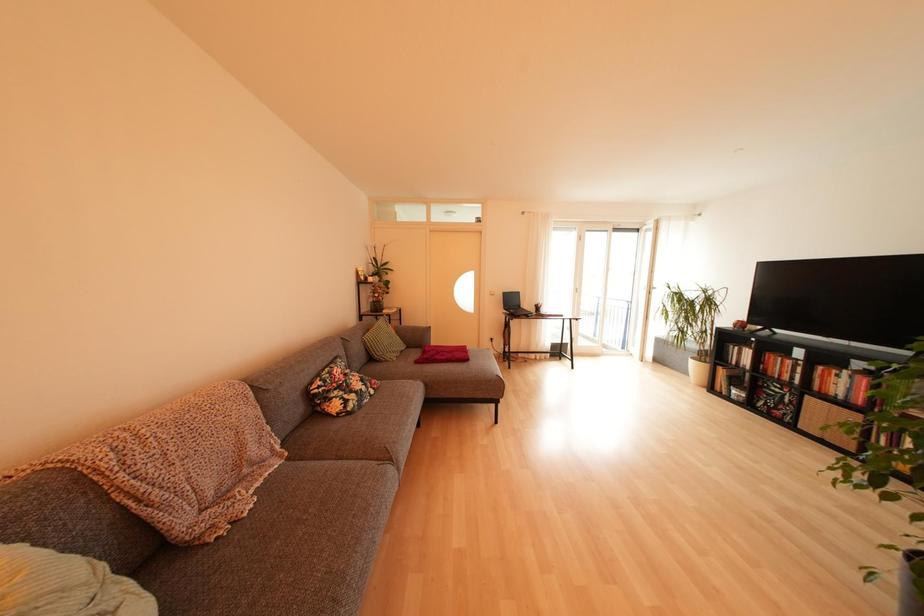
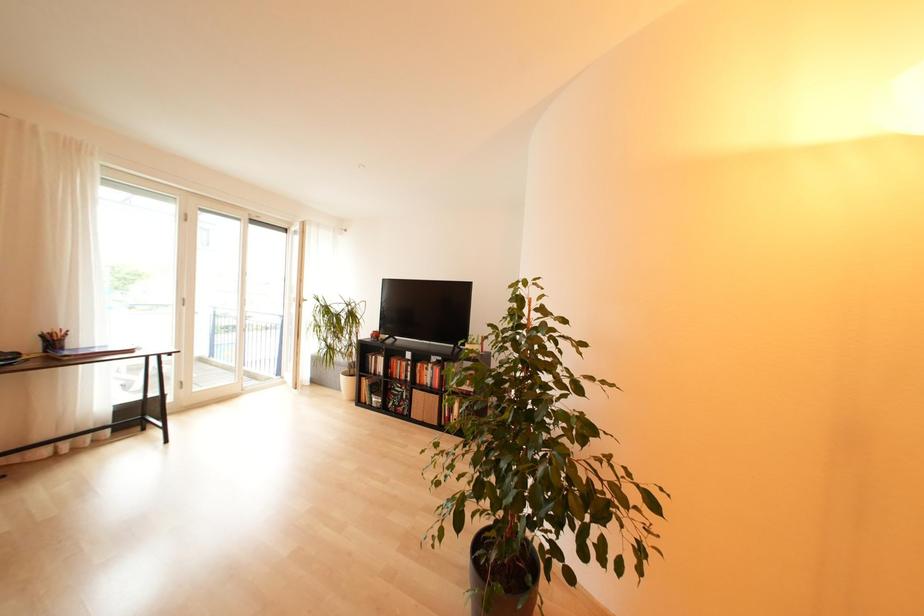
Question: Based on the continuous images, in which direction is the camera rotating? Reply with the corresponding letter.

Choices:
 (A) Left
 (B) Right
 (C) Up
 (D) Down

Answer: (B)